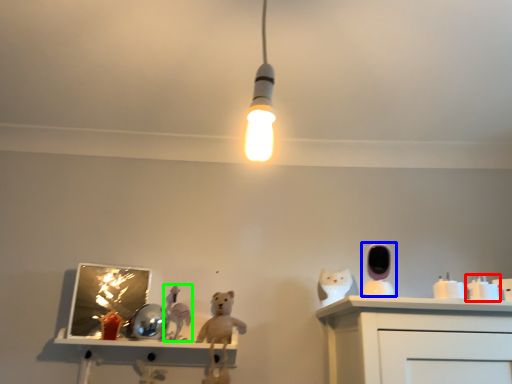
Question: Which object is positioned farthest from toy (highlighted by a red box)? Select from toy (highlighted by a blue box) and toy (highlighted by a green box).

Choices:
 (A) toy
 (B) toy

Answer: (B)